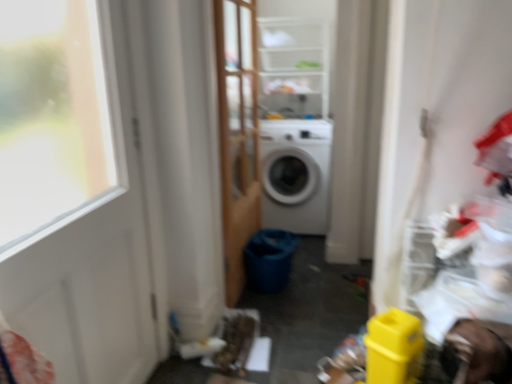
Question: Does wooden screen door at center touch white matte washing machine at center?

Choices:
 (A) no
 (B) yes

Answer: (A)

Question: Can you confirm if wooden screen door at center is thinner than white matte washing machine at center?

Choices:
 (A) yes
 (B) no

Answer: (A)

Question: Is wooden screen door at center far away from white matte washing machine at center?

Choices:
 (A) no
 (B) yes

Answer: (A)

Question: Is the position of wooden screen door at center more distant than that of white matte washing machine at center?

Choices:
 (A) no
 (B) yes

Answer: (A)

Question: Can we say wooden screen door at center lies outside white matte washing machine at center?

Choices:
 (A) yes
 (B) no

Answer: (A)

Question: Does point (298, 157) appear closer or farther from the camera than point (225, 44)?

Choices:
 (A) farther
 (B) closer

Answer: (A)

Question: In the image, is white matte washing machine at center positioned in front of or behind wooden screen door at center?

Choices:
 (A) behind
 (B) front

Answer: (A)

Question: Would you say white matte washing machine at center is to the left or to the right of wooden screen door at center in the picture?

Choices:
 (A) right
 (B) left

Answer: (A)

Question: From a real-world perspective, is white matte washing machine at center positioned above or below wooden screen door at center?

Choices:
 (A) above
 (B) below

Answer: (B)

Question: From their relative heights in the image, would you say white matte door at left is taller or shorter than wooden screen door at center?

Choices:
 (A) short
 (B) tall

Answer: (A)

Question: Considering their positions, is white matte door at left located in front of or behind wooden screen door at center?

Choices:
 (A) behind
 (B) front

Answer: (B)

Question: Is white matte door at left wider or thinner than wooden screen door at center?

Choices:
 (A) thin
 (B) wide

Answer: (A)

Question: From a real-world perspective, relative to wooden screen door at center, is white matte door at left vertically above or below?

Choices:
 (A) above
 (B) below

Answer: (B)

Question: From a real-world perspective, is clear plastic shelves at upper center physically located above or below white matte washing machine at center?

Choices:
 (A) above
 (B) below

Answer: (A)

Question: Is point pos(304,34) positioned closer to the camera than point pos(268,201)?

Choices:
 (A) farther
 (B) closer

Answer: (A)